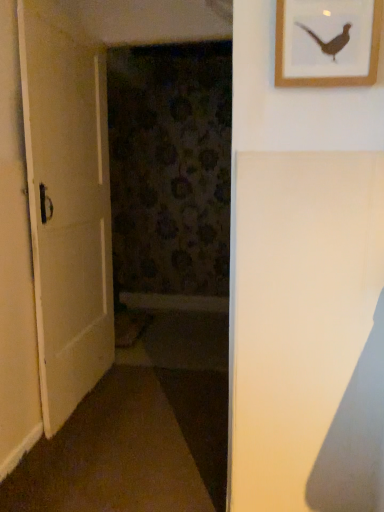
Question: Is white matte door at left facing away from wooden picture frame at upper right?

Choices:
 (A) yes
 (B) no

Answer: (B)

Question: From the image's perspective, is white matte door at left beneath wooden picture frame at upper right?

Choices:
 (A) no
 (B) yes

Answer: (B)

Question: From the image's perspective, does white matte door at left appear higher than wooden picture frame at upper right?

Choices:
 (A) yes
 (B) no

Answer: (B)

Question: Is white matte door at left taller than wooden picture frame at upper right?

Choices:
 (A) yes
 (B) no

Answer: (A)

Question: Is white matte door at left at the right side of wooden picture frame at upper right?

Choices:
 (A) no
 (B) yes

Answer: (A)

Question: Would you say white matte door at left contains wooden picture frame at upper right?

Choices:
 (A) yes
 (B) no

Answer: (B)

Question: Is wooden picture frame at upper right turned away from white matte door at left?

Choices:
 (A) yes
 (B) no

Answer: (B)

Question: Does wooden picture frame at upper right appear on the right side of white matte door at left?

Choices:
 (A) no
 (B) yes

Answer: (B)

Question: Does wooden picture frame at upper right have a greater width compared to white matte door at left?

Choices:
 (A) yes
 (B) no

Answer: (B)

Question: Can you confirm if wooden picture frame at upper right is shorter than white matte door at left?

Choices:
 (A) yes
 (B) no

Answer: (A)

Question: Does wooden picture frame at upper right turn towards white matte door at left?

Choices:
 (A) yes
 (B) no

Answer: (B)

Question: Is wooden picture frame at upper right further to the viewer compared to white matte door at left?

Choices:
 (A) yes
 (B) no

Answer: (B)

Question: From the image's perspective, relative to white matte door at left, is wooden picture frame at upper right above or below?

Choices:
 (A) below
 (B) above

Answer: (B)